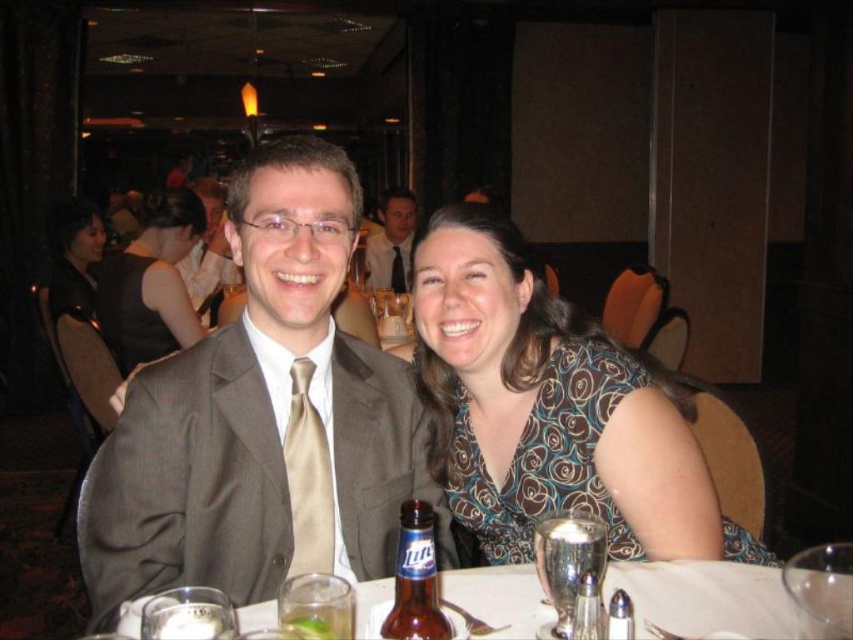
Between point (322, 288) and point (711, 589), which one is positioned behind?

The point (322, 288) is more distant.

Can you confirm if matte gray suit at center is smaller than clear glass at lower center?

No, matte gray suit at center is not smaller than clear glass at lower center.

Image resolution: width=853 pixels, height=640 pixels. What are the coordinates of `matte gray suit at center` in the screenshot? It's located at (265, 417).

Locate an element on the screen. The image size is (853, 640). matte gray suit at center is located at coordinates (265, 417).

Who is positioned more to the left, clear glass at lower center or brown glass beer bottle at center?

clear glass at lower center

Who is taller, clear glass at lower center or brown glass beer bottle at center?

brown glass beer bottle at center is taller.

Which is in front, point (730, 577) or point (590, 600)?

Point (590, 600) is in front.

Locate an element on the screen. Image resolution: width=853 pixels, height=640 pixels. clear glass at lower center is located at coordinates (708, 600).

Can you confirm if matte gray suit at center is taller than matte black dress at center?

No.

Can you confirm if matte gray suit at center is positioned below matte black dress at center?

Indeed, matte gray suit at center is positioned under matte black dress at center.

Is point (99, 596) behind point (165, 284)?

No, it is not.

Locate an element on the screen. The height and width of the screenshot is (640, 853). matte gray suit at center is located at coordinates (265, 417).